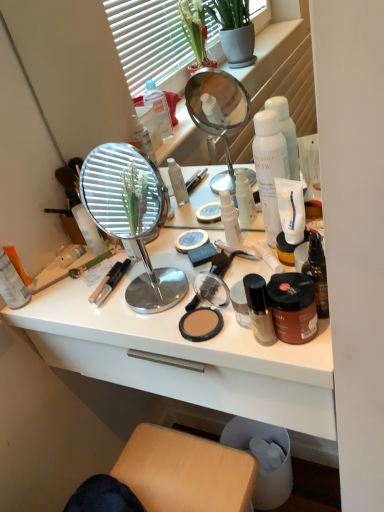
Question: Is orange matte lotion at left, positioned as the first toiletry in left-to-right order, to the right of silver/metallic mirror at center from the viewer's perspective?

Choices:
 (A) yes
 (B) no

Answer: (B)

Question: Is orange matte lotion at left, positioned as the first toiletry in left-to-right order, in front of silver/metallic mirror at center?

Choices:
 (A) yes
 (B) no

Answer: (B)

Question: Can you confirm if orange matte lotion at left, positioned as the first toiletry in left-to-right order, is smaller than silver/metallic mirror at center?

Choices:
 (A) no
 (B) yes

Answer: (B)

Question: Is orange matte lotion at left, positioned as the first toiletry in left-to-right order, at the left side of silver/metallic mirror at center?

Choices:
 (A) no
 (B) yes

Answer: (B)

Question: Does orange matte lotion at left, the 5th toiletry positioned from the right, have a lesser height compared to silver/metallic mirror at center?

Choices:
 (A) no
 (B) yes

Answer: (B)

Question: Is matte black compact at center wider or thinner than orange matte lotion at left, the 5th toiletry positioned from the right?

Choices:
 (A) wide
 (B) thin

Answer: (A)

Question: Is matte black compact at center spatially inside orange matte lotion at left, the 5th toiletry positioned from the right, or outside of it?

Choices:
 (A) outside
 (B) inside

Answer: (A)

Question: From a real-world perspective, is matte black compact at center physically located above or below orange matte lotion at left, positioned as the first toiletry in left-to-right order?

Choices:
 (A) above
 (B) below

Answer: (B)

Question: Visually, is matte black compact at center positioned to the left or to the right of orange matte lotion at left, the 5th toiletry positioned from the right?

Choices:
 (A) right
 (B) left

Answer: (A)

Question: Based on their sizes in the image, would you say brown matte jar at center-right, which appears as the second toiletry when viewed from the right, is bigger or smaller than silver/metallic mirror at center?

Choices:
 (A) small
 (B) big

Answer: (A)

Question: Is brown matte jar at center-right, the fourth toiletry positioned from the left, in front of or behind silver/metallic mirror at center in the image?

Choices:
 (A) behind
 (B) front

Answer: (A)

Question: Considering the positions of point (299, 322) and point (109, 189), is point (299, 322) closer or farther from the camera than point (109, 189)?

Choices:
 (A) farther
 (B) closer

Answer: (B)

Question: From the image's perspective, is brown matte jar at center-right, which appears as the second toiletry when viewed from the right, located above or below silver/metallic mirror at center?

Choices:
 (A) below
 (B) above

Answer: (A)

Question: From the image's perspective, relative to shiny brown bottle at right, the 5th toiletry viewed from the left, is white matte pump bottle at center, the 2th toiletry positioned from the left, above or below?

Choices:
 (A) above
 (B) below

Answer: (A)

Question: Considering the positions of white matte pump bottle at center, the 2th toiletry positioned from the left, and shiny brown bottle at right, which is the 1th toiletry in right-to-left order, in the image, is white matte pump bottle at center, the 2th toiletry positioned from the left, taller or shorter than shiny brown bottle at right, which is the 1th toiletry in right-to-left order,?

Choices:
 (A) tall
 (B) short

Answer: (B)